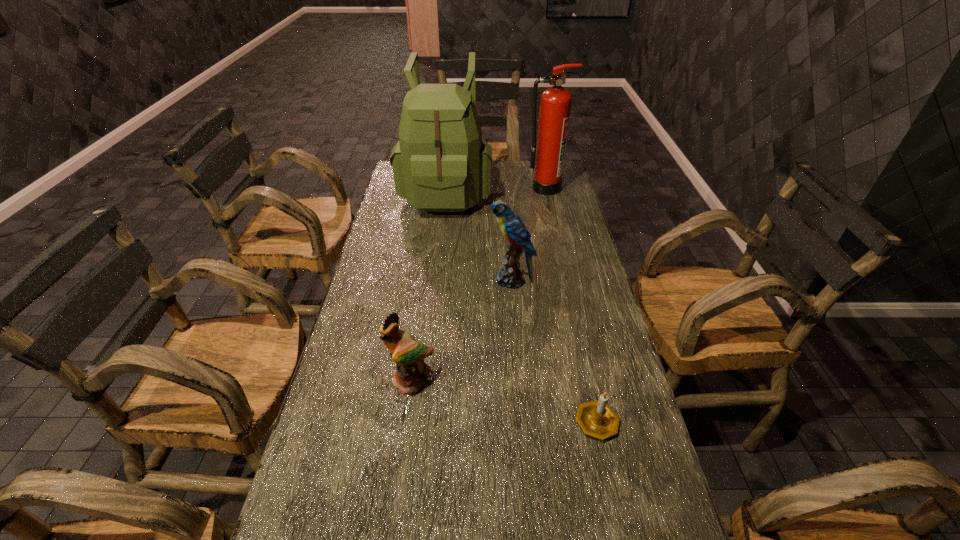
Where is `vacant area between the fire extinguisher and the nearest object`? This screenshot has width=960, height=540. vacant area between the fire extinguisher and the nearest object is located at coordinates (571, 304).

Find the location of a particular element. The height and width of the screenshot is (540, 960). free area in between the fire extinguisher and the nearest object is located at coordinates (571, 304).

At what (x,y) coordinates should I click in order to perform the action: click on free area in between the fire extinguisher and the nearer parrot. Please return your answer as a coordinate pair (x, y). Looking at the image, I should click on (478, 285).

Image resolution: width=960 pixels, height=540 pixels. Identify the location of object that ranks as the second closest to the left parrot. (596, 418).

The image size is (960, 540). What are the coordinates of `object that stands as the closest to the fire extinguisher` in the screenshot? It's located at (440, 164).

Locate an element on the screen. The height and width of the screenshot is (540, 960). free space in the image that satisfies the following two spatial constraints: 1. on the face of the farther parrot; 2. on the front-facing side of the fourth farthest object is located at coordinates (519, 381).

In order to click on free location that satisfies the following two spatial constraints: 1. with the nozzle pointing from the back of the fire extinguisher; 2. on the face of the right parrot in this screenshot , I will do click(565, 280).